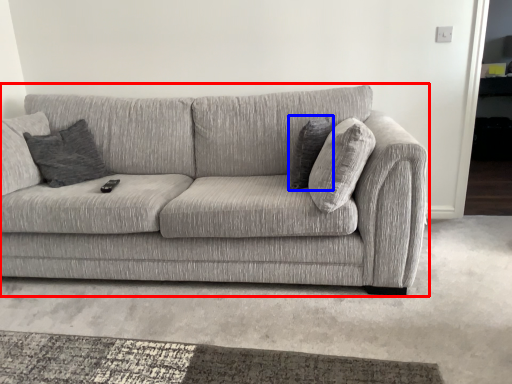
Question: Which object is closer to the camera taking this photo, studio couch (highlighted by a red box) or pillow (highlighted by a blue box)?

Choices:
 (A) studio couch
 (B) pillow

Answer: (A)